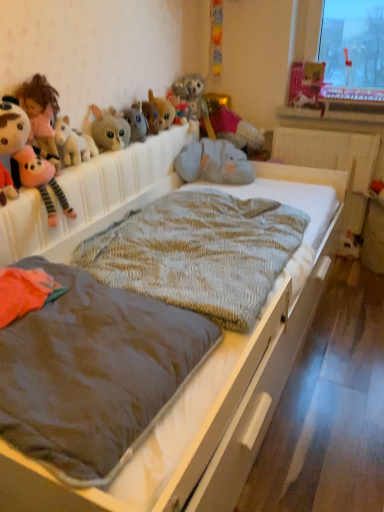
What is the approximate width of fluffy plush toy at left, which appears as the seventh toy when viewed from the right?

3.50 inches.

This screenshot has width=384, height=512. What do you see at coordinates (333, 161) in the screenshot?
I see `white textured radiator at center` at bounding box center [333, 161].

In order to face soft plush toy at left, the eighth toy from the right, should I rotate leftwards or rightwards?

It's best to rotate left around 24.668 degrees.

Image resolution: width=384 pixels, height=512 pixels. Describe the element at coordinates (12, 127) in the screenshot. I see `soft plush toy at left, which is the 1th toy in left-to-right order` at that location.

In the scene shown: Measure the distance between point (153, 406) and camera.

Point (153, 406) is 36.54 inches from camera.

This screenshot has width=384, height=512. Find the location of `soft plush doll at upper left`. soft plush doll at upper left is located at coordinates (41, 116).

This screenshot has width=384, height=512. What are the coordinates of `fluffy plush toy at left, which appears as the seventh toy when viewed from the right` in the screenshot? It's located at (73, 143).

Is fuzzy fabric bunny at upper center, which is counted as the fifth toy, starting from the left, not inside gray plush elephant at center?

Yes.

Are fuzzy fabric bunny at upper center, which ranks as the 4th toy in right-to-left order, and gray plush elephant at center far apart?

They are positioned close to each other.

Between fuzzy fabric bunny at upper center, which is counted as the fifth toy, starting from the left, and gray plush elephant at center, which one has smaller size?

fuzzy fabric bunny at upper center, which is counted as the fifth toy, starting from the left, is smaller.

From the image's perspective, starting from the gray plush elephant at center, which toy is the 3rd one above? Please provide its 2D coordinates.

[(162, 110)]

Is matte pink castle at upper right, which is the eighth toy from left to right, to the left of knitted fabric bed at center from the viewer's perspective?

No, matte pink castle at upper right, which is the eighth toy from left to right, is not to the left of knitted fabric bed at center.

From the image's perspective, is matte pink castle at upper right, which is the eighth toy from left to right, over knitted fabric bed at center?

Yes.

Is matte pink castle at upper right, placed as the 1th toy when sorted from right to left, facing away from knitted fabric bed at center?

No, matte pink castle at upper right, placed as the 1th toy when sorted from right to left, is not facing the opposite direction of knitted fabric bed at center.

Is knitted fabric bed at center surrounded by matte pink castle at upper right, placed as the 1th toy when sorted from right to left?

No.

Which object is wider, velvet pink pillow at upper center, placed as the 2th toy when sorted from right to left, or knitted woolen blanket at center, which appears as the 1th blanket when viewed from the back?

Wider between the two is knitted woolen blanket at center, which appears as the 1th blanket when viewed from the back.

Considering the sizes of objects velvet pink pillow at upper center, which is counted as the 7th toy, starting from the left, and knitted woolen blanket at center, which is counted as the 2th blanket, starting from the front, in the image provided, who is bigger, velvet pink pillow at upper center, which is counted as the 7th toy, starting from the left, or knitted woolen blanket at center, which is counted as the 2th blanket, starting from the front,?

knitted woolen blanket at center, which is counted as the 2th blanket, starting from the front.

Does velvet pink pillow at upper center, which is counted as the 7th toy, starting from the left, have a greater height compared to knitted woolen blanket at center, which is counted as the 2th blanket, starting from the front?

Indeed, velvet pink pillow at upper center, which is counted as the 7th toy, starting from the left, has a greater height compared to knitted woolen blanket at center, which is counted as the 2th blanket, starting from the front.

From the image's perspective, starting from the velvet pink pillow at upper center, which is counted as the 7th toy, starting from the left, which blanket is the 1st one below? Please provide its 2D coordinates.

[(198, 253)]

Is point (97, 123) less distant than point (83, 150)?

No, (97, 123) is behind (83, 150).

Considering the positions of objects fuzzy fabric stuffed rabbit at upper center, arranged as the third toy when viewed from the left, and fluffy plush toy at left, which is the second toy from left to right, in the image provided, who is more to the left, fuzzy fabric stuffed rabbit at upper center, arranged as the third toy when viewed from the left, or fluffy plush toy at left, which is the second toy from left to right,?

fluffy plush toy at left, which is the second toy from left to right.

In terms of width, does fuzzy fabric stuffed rabbit at upper center, the 6th toy when ordered from right to left, look wider or thinner when compared to fluffy plush toy at left, which is the second toy from left to right?

Clearly, fuzzy fabric stuffed rabbit at upper center, the 6th toy when ordered from right to left, has more width compared to fluffy plush toy at left, which is the second toy from left to right.

In the scene shown: How many degrees apart are the facing directions of fuzzy fabric stuffed rabbit at upper center, the 6th toy when ordered from right to left, and fluffy plush toy at left, which is the second toy from left to right?

0.000411 degrees separate the facing orientations of fuzzy fabric stuffed rabbit at upper center, the 6th toy when ordered from right to left, and fluffy plush toy at left, which is the second toy from left to right.

From the picture: Can you tell me how much knitted woolen blanket at center, which is counted as the 2th blanket, starting from the front, and soft plush doll at upper left differ in facing direction?

0.00253 degrees.

Which is more to the left, knitted woolen blanket at center, which is counted as the 2th blanket, starting from the front, or soft plush doll at upper left?

From the viewer's perspective, soft plush doll at upper left appears more on the left side.

Is knitted woolen blanket at center, which appears as the 1th blanket when viewed from the back, wider than soft plush doll at upper left?

Yes, knitted woolen blanket at center, which appears as the 1th blanket when viewed from the back, is wider than soft plush doll at upper left.

Find the location of a particular element. child above the knitted woolen blanket at center, which is counted as the 2th blanket, starting from the front (from the image's perspective) is located at coordinates (41, 116).

Are white plastic window sill at upper center and fuzzy fabric bunny at upper center, which ranks as the 4th toy in right-to-left order, located far from each other?

No, there isn't a large distance between white plastic window sill at upper center and fuzzy fabric bunny at upper center, which ranks as the 4th toy in right-to-left order.

From the image's perspective, is white plastic window sill at upper center located beneath fuzzy fabric bunny at upper center, which is counted as the fifth toy, starting from the left?

No.

Does white plastic window sill at upper center have a lesser width compared to fuzzy fabric bunny at upper center, which ranks as the 4th toy in right-to-left order?

In fact, white plastic window sill at upper center might be wider than fuzzy fabric bunny at upper center, which ranks as the 4th toy in right-to-left order.

Which object is positioned more to the left, white plastic window sill at upper center or fuzzy fabric bunny at upper center, which ranks as the 4th toy in right-to-left order?

fuzzy fabric bunny at upper center, which ranks as the 4th toy in right-to-left order.

Is white textured radiator at center turned away from soft plush toy at left, the eighth toy from the right?

That's not correct — white textured radiator at center is not looking away from soft plush toy at left, the eighth toy from the right.

Is white textured radiator at center outside of soft plush toy at left, which is the 1th toy in left-to-right order?

Yes.

In the scene shown: Does white textured radiator at center lie behind soft plush toy at left, which is the 1th toy in left-to-right order?

Yes, the depth of white textured radiator at center is greater than that of soft plush toy at left, which is the 1th toy in left-to-right order.

Can you tell me how much white textured radiator at center and soft plush toy at left, which is the 1th toy in left-to-right order, differ in facing direction?

84.7 degrees.

In order to click on animal below the fuzzy fabric bunny at upper center, which ranks as the 4th toy in right-to-left order (from the image's perspective) in this screenshot , I will do `click(214, 163)`.

Where is `bed in front of the matte pink castle at upper right, placed as the 1th toy when sorted from right to left`? bed in front of the matte pink castle at upper right, placed as the 1th toy when sorted from right to left is located at coordinates (211, 383).

Based on their spatial positions, is soft plush toy at left, the eighth toy from the right, or knitted woolen blanket at center, the first blanket in the front-to-back sequence, closer to fluffy plush toy at upper center, placed as the fourth toy when sorted from left to right?

soft plush toy at left, the eighth toy from the right, is positioned closer to the anchor fluffy plush toy at upper center, placed as the fourth toy when sorted from left to right.

Looking at the image, which one is located closer to matte pink castle at upper right, placed as the 1th toy when sorted from right to left, fuzzy fabric bunny at upper center, which ranks as the 4th toy in right-to-left order, or soft plush toy at left, which is the 1th toy in left-to-right order?

The object closer to matte pink castle at upper right, placed as the 1th toy when sorted from right to left, is fuzzy fabric bunny at upper center, which ranks as the 4th toy in right-to-left order.

Consider the image. Looking at the image, which one is located further to knitted woolen blanket at center, which is counted as the 2th blanket, starting from the front, fuzzy fabric bunny at upper center, which is counted as the fifth toy, starting from the left, or white textured radiator at center?

white textured radiator at center.

Which object lies nearer to the anchor point fuzzy fabric stuffed rabbit at upper center, arranged as the third toy when viewed from the left, knitted woolen blanket at center, which is counted as the 2th blanket, starting from the front, or soft plush doll at upper left?

soft plush doll at upper left is closer to fuzzy fabric stuffed rabbit at upper center, arranged as the third toy when viewed from the left.

Estimate the real-world distances between objects in this image. Which object is closer to velvet pink pillow at upper center, which is counted as the 7th toy, starting from the left, white plastic window sill at upper center or matte pink castle at upper right, which is the eighth toy from left to right?

white plastic window sill at upper center.

Which object lies nearer to the anchor point fuzzy fabric bunny at upper center, which is counted as the fifth toy, starting from the left, knitted fabric bed at center or gray plush elephant at center?

gray plush elephant at center.

When comparing their distances from fluffy plush toy at upper center, placed as the fourth toy when sorted from left to right, does white textured radiator at center or fuzzy fabric bunny at upper center, which ranks as the 4th toy in right-to-left order, seem further?

Based on the image, white textured radiator at center appears to be further to fluffy plush toy at upper center, placed as the fourth toy when sorted from left to right.

From the image, which object appears to be farther from fuzzy fabric bunny at upper center, which is counted as the fifth toy, starting from the left, fluffy plush toy at left, which appears as the seventh toy when viewed from the right, or knitted woolen blanket at center, which appears as the 1th blanket when viewed from the back?

The object further to fuzzy fabric bunny at upper center, which is counted as the fifth toy, starting from the left, is knitted woolen blanket at center, which appears as the 1th blanket when viewed from the back.

This screenshot has width=384, height=512. I want to click on animal located between soft plush toy at left, which is the 1th toy in left-to-right order, and matte pink castle at upper right, placed as the 1th toy when sorted from right to left, in the left-right direction, so click(x=214, y=163).

This screenshot has width=384, height=512. Identify the location of animal between fuzzy fabric stuffed rabbit at upper center, arranged as the third toy when viewed from the left, and matte pink castle at upper right, which is the eighth toy from left to right, in the horizontal direction. (214, 163).

Image resolution: width=384 pixels, height=512 pixels. I want to click on child between knitted woolen blanket at center, the first blanket in the front-to-back sequence, and matte pink castle at upper right, placed as the 1th toy when sorted from right to left, from front to back, so click(41, 116).

You are a GUI agent. You are given a task and a screenshot of the screen. Output one action in this format:
    pyautogui.click(x=<x>, y=<y>)
    Task: Click on the child positioned between soft plush toy at left, the eighth toy from the right, and velvet pink pillow at upper center, which is counted as the 7th toy, starting from the left, from near to far
    The height and width of the screenshot is (512, 384).
    Given the screenshot: What is the action you would take?
    pyautogui.click(x=41, y=116)